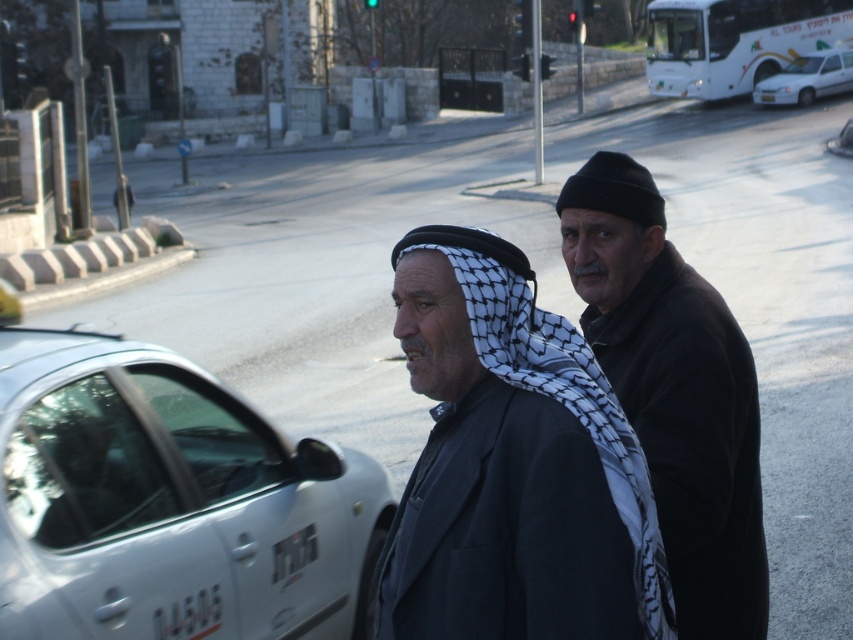
You are a pedestrian trying to cross the road safely. You see a white matte bus at upper right and a metallic silver car at right. Which vehicle is wider from your perspective?

The white matte bus at upper right is wider than the metallic silver car at right according to the description.

You are a pedestrian standing at the point labeled as point (807, 77). You want to cross the street to reach the sidewalk where the two men are standing. Is the white taxi blocking your path?

The point (807, 77) corresponds to the white glossy car at upper right, so the white taxi is not blocking your path to the sidewalk where the two men are standing.